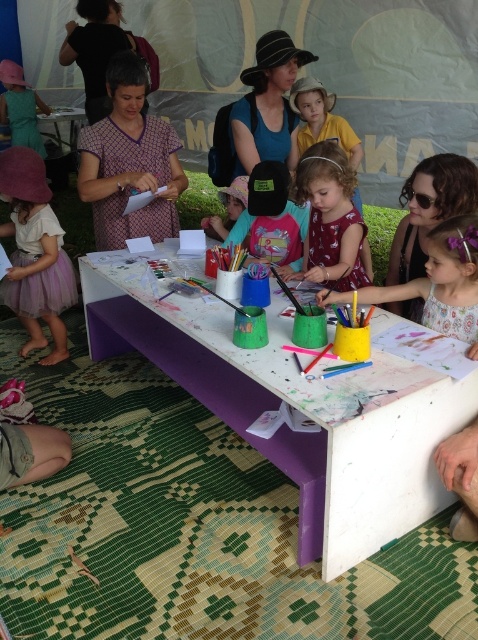
You are a photographer trying to capture a candid shot of the children at the art table. You notice the matte pink dress at center and the yellow matte shirt at upper center. Which child should you focus on to get a clearer shot of their face, considering their clothing length?

The matte pink dress at center is shorter than the yellow matte shirt at upper center, so focusing on the child wearing the yellow matte shirt at upper center would provide a clearer view of their face since the longer shirt may cover less of the upper body compared to the shorter dress.

You are standing at the position of point [288,189] and want to move towards the table covered with a white cloth and purple base. Is point [314,192] in front of you or behind you?

Point [314,192] is in front of point [288,189], so it is in front of you.

You are an observer looking at the scene. There is a matte yellow cup at center and a matte blue shirt at center. Which object is positioned to the right side?

The matte yellow cup at center is to the right of the matte blue shirt at center.